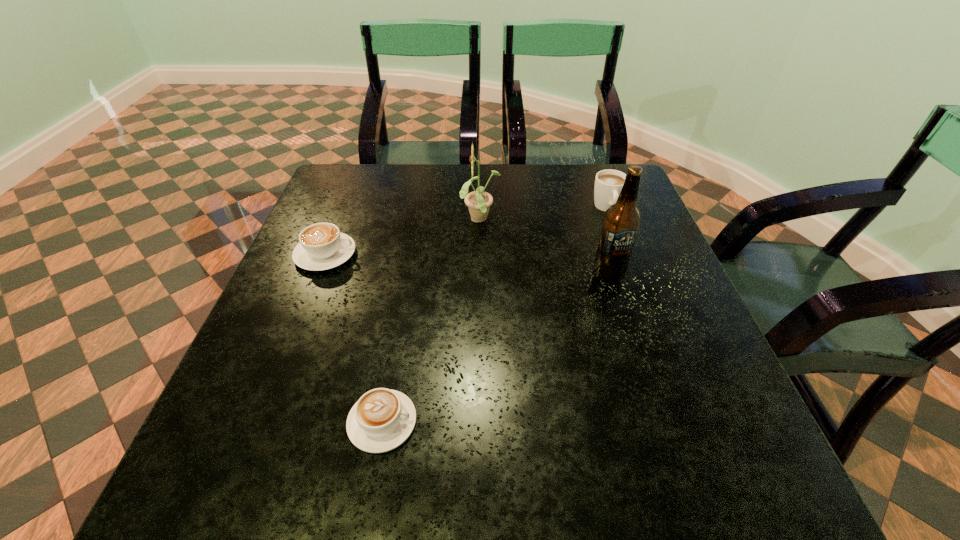
Identify the location of free space between the shortest cappuccino and the rightmost cappuccino. The width and height of the screenshot is (960, 540). (494, 315).

You are a GUI agent. You are given a task and a screenshot of the screen. Output one action in this format:
    pyautogui.click(x=<x>, y=<y>)
    Task: Click on the empty space that is in between the leftmost object and the nearest object
    This screenshot has height=540, width=960.
    Given the screenshot: What is the action you would take?
    pyautogui.click(x=354, y=338)

Locate an element on the screen. The height and width of the screenshot is (540, 960). vacant space that is in between the second shortest cappuccino and the rightmost cappuccino is located at coordinates (467, 231).

The height and width of the screenshot is (540, 960). I want to click on free space between the beer bottle and the second farthest cappuccino, so click(467, 265).

Identify the location of vacant area that lies between the third object from right to left and the second tallest cappuccino. (403, 238).

The image size is (960, 540). In order to click on empty location between the tallest object and the fourth shortest object in this screenshot , I will do `click(544, 248)`.

Locate an element on the screen. Image resolution: width=960 pixels, height=540 pixels. vacant area between the beer bottle and the shortest object is located at coordinates (495, 348).

The image size is (960, 540). What are the coordinates of `free space between the second object from left to right and the second tallest object` in the screenshot? It's located at click(431, 321).

This screenshot has height=540, width=960. I want to click on free space between the sunflower and the second farthest cappuccino, so click(403, 238).

Choose which object is the third nearest neighbor to the third shortest object. Please provide its 2D coordinates. Your answer should be formatted as a tuple, i.e. [(x, y)], where the tuple contains the x and y coordinates of a point satisfying the conditions above.

[(322, 246)]